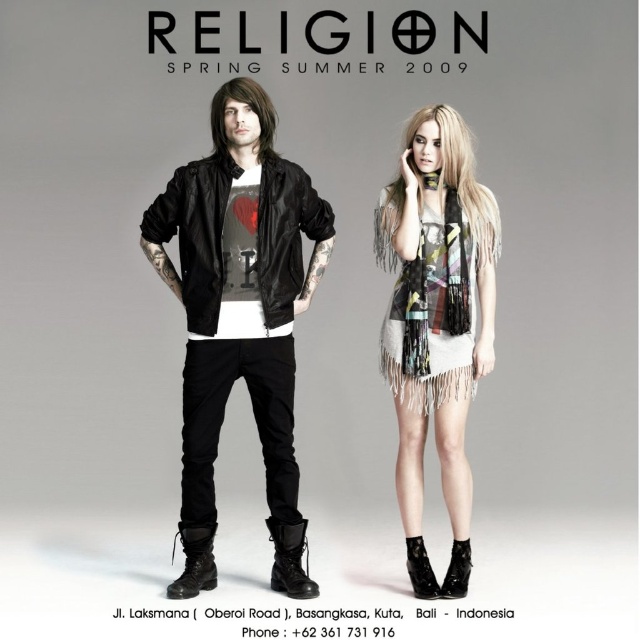
Question: Estimate the real-world distances between objects in this image. Which object is farther from the fringed scarf at center?

Choices:
 (A) matte black bomber jacket at center
 (B) printed chiffon dress at center

Answer: (A)

Question: Does fringed scarf at center have a lesser width compared to printed chiffon dress at center?

Choices:
 (A) no
 (B) yes

Answer: (A)

Question: Which of the following is the farthest from the observer?

Choices:
 (A) (268, 497)
 (B) (400, 310)
 (C) (456, 595)

Answer: (A)

Question: Can you confirm if matte black bomber jacket at center is thinner than printed chiffon dress at center?

Choices:
 (A) yes
 (B) no

Answer: (B)

Question: Is matte black bomber jacket at center to the left of fringed scarf at center from the viewer's perspective?

Choices:
 (A) no
 (B) yes

Answer: (B)

Question: Which point is farther from the camera taking this photo?

Choices:
 (A) (444, 336)
 (B) (472, 248)

Answer: (B)